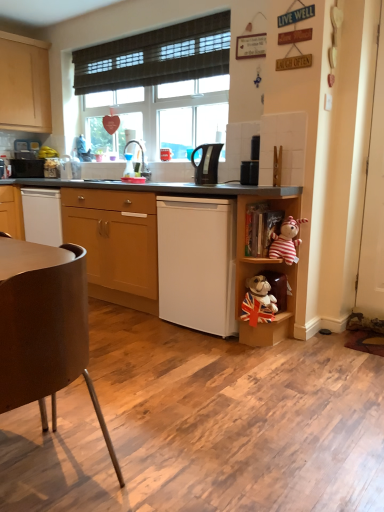
Identify the location of vacant space that's between brown matte chair at lower left and white matte dishwasher at center. This screenshot has width=384, height=512. (x=147, y=373).